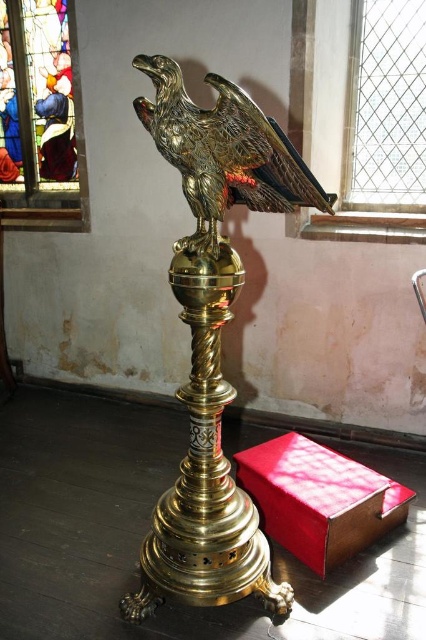
Who is positioned more to the left, gold polished eagle at center or shiny gold eagle at center?

From the viewer's perspective, shiny gold eagle at center appears more on the left side.

Identify the location of gold polished eagle at center. (213, 337).

Is gold polished eagle at center wider than stained glass at upper left?

No, gold polished eagle at center is not wider than stained glass at upper left.

Is point (192, 390) less distant than point (0, 26)?

That is True.

Does point (169, 490) lie behind point (66, 125)?

No.

Where is `gold polished eagle at center`? gold polished eagle at center is located at coordinates (213, 337).

Can you confirm if stained glass at upper left is shorter than clear glass window at upper right?

Incorrect, stained glass at upper left's height does not fall short of clear glass window at upper right's.

Measure the distance from stained glass at upper left to clear glass window at upper right.

They are 1.63 meters apart.

Between point (26, 166) and point (419, 97), which one is positioned behind?

The point (26, 166) is more distant.

What are the coordinates of `stained glass at upper left` in the screenshot? It's located at pos(40,116).